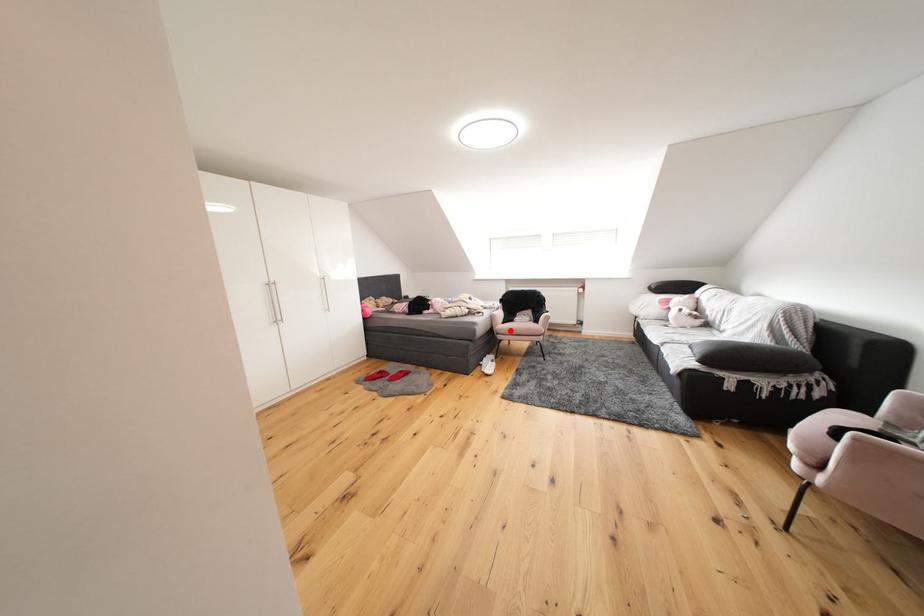
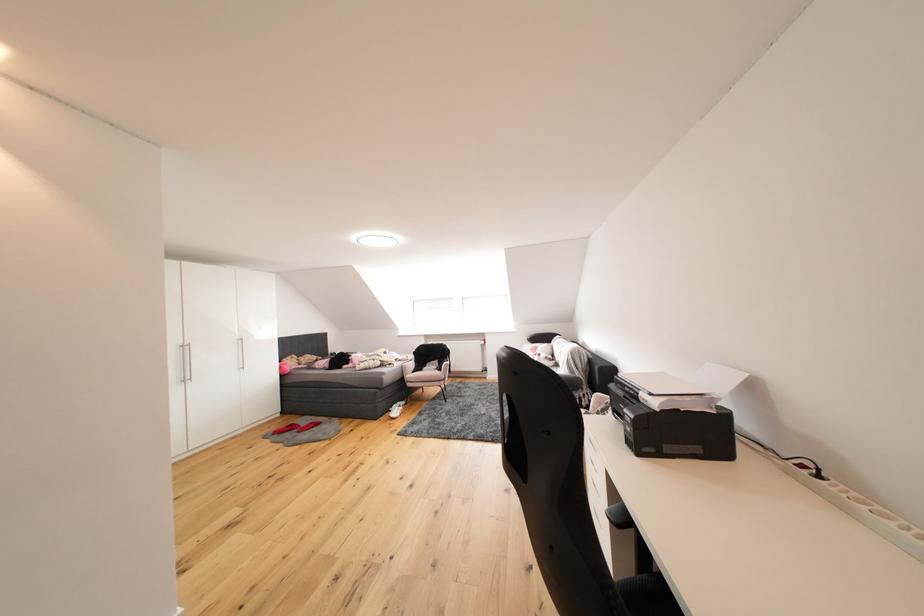
The point at the highlighted location is marked in the first image. Where is the corresponding point in the second image?

(419, 379)